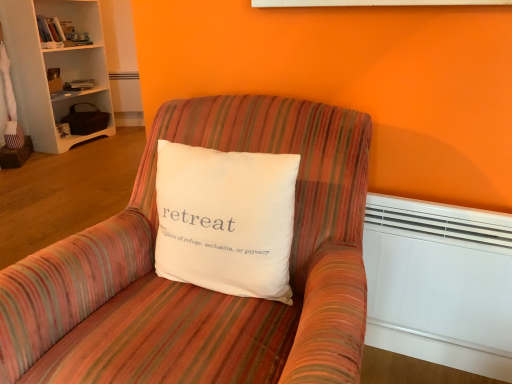
Where is `vacant region in front of white wood bookcase at upper left`? Image resolution: width=512 pixels, height=384 pixels. vacant region in front of white wood bookcase at upper left is located at coordinates (72, 155).